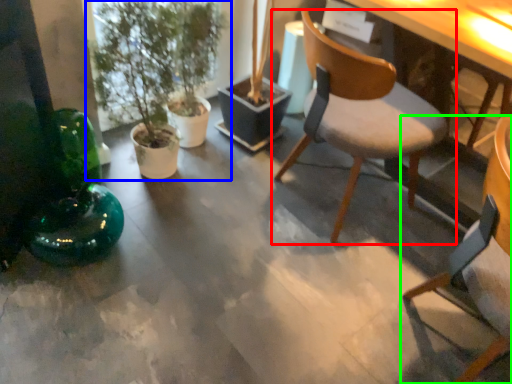
Question: Based on their relative distances, which object is nearer to chair (highlighted by a red box)? Choose from houseplant (highlighted by a blue box) and chair (highlighted by a green box).

Choices:
 (A) houseplant
 (B) chair

Answer: (B)